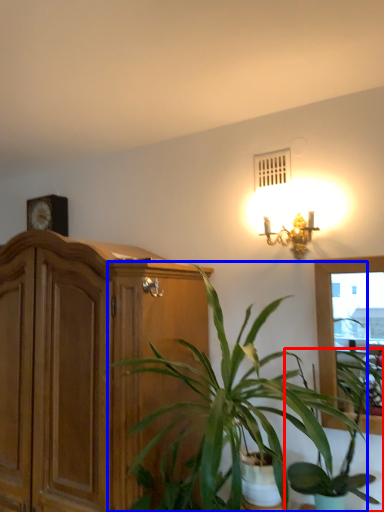
Question: Among these objects, which one is farthest to the camera, houseplant (highlighted by a red box) or houseplant (highlighted by a blue box)?

Choices:
 (A) houseplant
 (B) houseplant

Answer: (A)